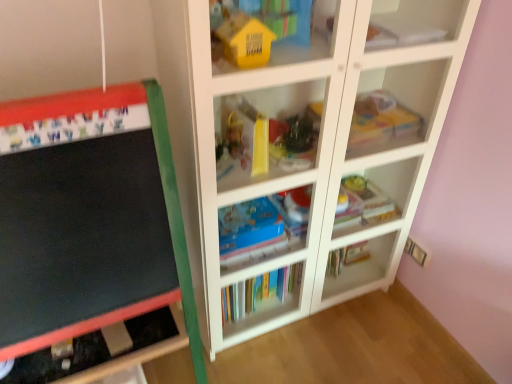
I want to click on blank space situated above blue cardboard book at center, placed as the 2th shelf when sorted from top to bottom (from a real-world perspective), so click(242, 212).